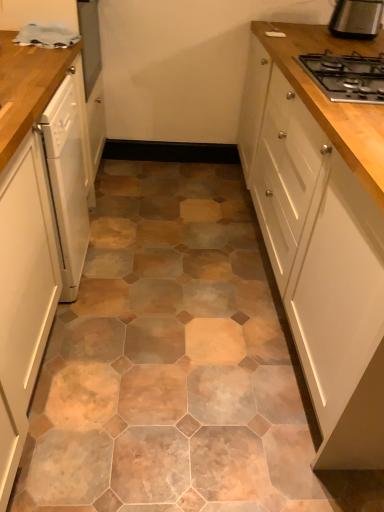
What are the coordinates of `white glossy cabinet at left, the first cabinetry viewed from the left` in the screenshot? It's located at (24, 237).

What do you see at coordinates (356, 19) in the screenshot? I see `black metallic toaster at upper right` at bounding box center [356, 19].

In order to face white glossy cabinet at upper right, which is the 2th cabinetry from left to right, should I rotate leftwards or rightwards?

You should rotate right by 22.775 degrees.

Find the location of a particular element. The width and height of the screenshot is (384, 512). white glossy cabinet at left, the 2th cabinetry positioned from the right is located at coordinates (24, 237).

From the image's perspective, is white glossy cabinet at left, the first cabinetry viewed from the left, on wooden at left?

No, from the image's perspective, white glossy cabinet at left, the first cabinetry viewed from the left, is not above wooden at left.

Based on the photo, which of these two, white glossy cabinet at left, the 2th cabinetry positioned from the right, or wooden at left, is smaller?

wooden at left is smaller.

Are white glossy cabinet at left, the first cabinetry viewed from the left, and wooden at left far apart?

No.

Is the depth of white glossy cabinet at left, the 2th cabinetry positioned from the right, greater than that of wooden at left?

No, it is in front of wooden at left.

Locate an element on the screen. gas stove that appears in front of the wooden at left is located at coordinates (346, 76).

From a real-world perspective, is wooden at left under black metal gas stove at upper right?

Indeed, from a real-world perspective, wooden at left is positioned beneath black metal gas stove at upper right.

Can you confirm if wooden at left is wider than black metal gas stove at upper right?

Yes, wooden at left is wider than black metal gas stove at upper right.

Would you say wooden at left is a long distance from black metal gas stove at upper right?

Yes, wooden at left and black metal gas stove at upper right are quite far apart.

Based on the photo, how many degrees apart are the facing directions of white glossy cabinet at upper right, which is the 2th cabinetry from left to right, and white glossy dishwasher at left?

The angle between the facing direction of white glossy cabinet at upper right, which is the 2th cabinetry from left to right, and the facing direction of white glossy dishwasher at left is 180 degrees.

Is white glossy cabinet at upper right, which is the 2th cabinetry from left to right, aimed at white glossy dishwasher at left?

Yes, white glossy cabinet at upper right, which is the 2th cabinetry from left to right, is turned towards white glossy dishwasher at left.

From a real-world perspective, is white glossy cabinet at upper right, marked as the first cabinetry in a right-to-left arrangement, beneath white glossy dishwasher at left?

No.

Does point (347, 59) appear closer or farther from the camera than point (278, 110)?

Point (347, 59) is positioned closer to the camera compared to point (278, 110).

Is black metal gas stove at upper right aimed at white glossy cabinet at upper right, which is the 2th cabinetry from left to right?

No, black metal gas stove at upper right is not facing towards white glossy cabinet at upper right, which is the 2th cabinetry from left to right.

Would you say black metal gas stove at upper right is outside white glossy cabinet at upper right, marked as the first cabinetry in a right-to-left arrangement?

Actually, black metal gas stove at upper right is at least partially inside white glossy cabinet at upper right, marked as the first cabinetry in a right-to-left arrangement.

From the image's perspective, is black metal gas stove at upper right located above or below white glossy cabinet at upper right, which is the 2th cabinetry from left to right?

Based on their image positions, black metal gas stove at upper right is located above white glossy cabinet at upper right, which is the 2th cabinetry from left to right.

Which of these two, black metal gas stove at upper right or black metallic toaster at upper right, is thinner?

black metallic toaster at upper right is thinner.

Which is less distant, [376,97] or [379,5]?

Point [376,97] is positioned closer to the camera compared to point [379,5].

How different are the orientations of black metal gas stove at upper right and black metallic toaster at upper right in degrees?

The angular difference between black metal gas stove at upper right and black metallic toaster at upper right is 90 degrees.

Is black metal gas stove at upper right oriented away from black metallic toaster at upper right?

No.

Is white glossy dishwasher at left placed right next to wooden at left?

white glossy dishwasher at left and wooden at left are not in contact.

From the picture: Considering the sizes of objects white glossy dishwasher at left and wooden at left in the image provided, who is bigger, white glossy dishwasher at left or wooden at left?

Bigger between the two is wooden at left.

Where is `countertop lying behind the white glossy dishwasher at left`? This screenshot has width=384, height=512. countertop lying behind the white glossy dishwasher at left is located at coordinates (27, 87).

Relative to wooden at left, is white glossy dishwasher at left in front or behind?

Clearly, white glossy dishwasher at left is in front of wooden at left.

Could you measure the distance between white glossy cabinet at left, the first cabinetry viewed from the left, and black metallic toaster at upper right?

white glossy cabinet at left, the first cabinetry viewed from the left, and black metallic toaster at upper right are 5.51 feet apart.

Which object is more forward, white glossy cabinet at left, the 2th cabinetry positioned from the right, or black metallic toaster at upper right?

Positioned in front is white glossy cabinet at left, the 2th cabinetry positioned from the right.

From a real-world perspective, who is located higher, white glossy cabinet at left, the first cabinetry viewed from the left, or black metallic toaster at upper right?

black metallic toaster at upper right.

Is there a large distance between white glossy cabinet at left, the first cabinetry viewed from the left, and black metallic toaster at upper right?

That's right, there is a large distance between white glossy cabinet at left, the first cabinetry viewed from the left, and black metallic toaster at upper right.

At what (x,y) coordinates should I click in order to perform the action: click on the 2nd cabinetry in front of the wooden at left, starting your count from the anchor. Please return your answer as a coordinate pair (x, y). This screenshot has height=512, width=384. Looking at the image, I should click on [x=24, y=237].

Locate an element on the screen. countertop above the black metal gas stove at upper right (from the image's perspective) is located at coordinates (27, 87).

Considering their positions, is black metal gas stove at upper right positioned further to white glossy dishwasher at left than wooden at left?

Among the two, black metal gas stove at upper right is located further to white glossy dishwasher at left.

Estimate the real-world distances between objects in this image. Which object is closer to black metal gas stove at upper right, wooden at left or black metallic toaster at upper right?

black metallic toaster at upper right is positioned closer to the anchor black metal gas stove at upper right.

Estimate the real-world distances between objects in this image. Which object is further from wooden at left, white glossy dishwasher at left or white glossy cabinet at left, the first cabinetry viewed from the left?

Among the two, white glossy dishwasher at left is located further to wooden at left.

Based on their spatial positions, is black metal gas stove at upper right or wooden at left further from black metallic toaster at upper right?

The object further to black metallic toaster at upper right is wooden at left.

When comparing their distances from white glossy dishwasher at left, does wooden at left or black metal gas stove at upper right seem closer?

The object closer to white glossy dishwasher at left is wooden at left.

Based on the photo, which object lies further to the anchor point black metal gas stove at upper right, white glossy dishwasher at left or wooden at left?

Among the two, white glossy dishwasher at left is located further to black metal gas stove at upper right.

Based on their spatial positions, is white glossy dishwasher at left or wooden at left further from white glossy cabinet at left, the 2th cabinetry positioned from the right?

white glossy dishwasher at left.

In the scene shown: Looking at the image, which one is located further to white glossy dishwasher at left, black metal gas stove at upper right or black metallic toaster at upper right?

black metallic toaster at upper right lies further to white glossy dishwasher at left than the other object.

Where is `gas stove between white glossy dishwasher at left and black metallic toaster at upper right`? gas stove between white glossy dishwasher at left and black metallic toaster at upper right is located at coordinates (346, 76).

The width and height of the screenshot is (384, 512). Find the location of `home appliance situated between white glossy cabinet at left, the first cabinetry viewed from the left, and black metal gas stove at upper right from left to right`. home appliance situated between white glossy cabinet at left, the first cabinetry viewed from the left, and black metal gas stove at upper right from left to right is located at coordinates (68, 175).

Where is `home appliance between wooden at left and black metal gas stove at upper right in the horizontal direction`? This screenshot has height=512, width=384. home appliance between wooden at left and black metal gas stove at upper right in the horizontal direction is located at coordinates (68, 175).

Find the location of a particular element. home appliance between white glossy cabinet at left, the 2th cabinetry positioned from the right, and white glossy cabinet at upper right, which is the 2th cabinetry from left to right, in the horizontal direction is located at coordinates (68, 175).